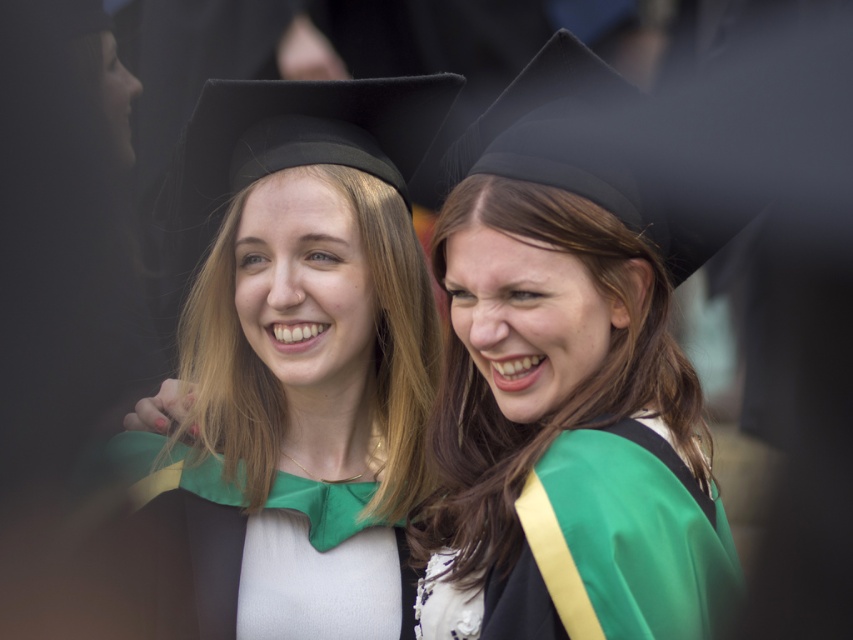
Question: Which point appears closest to the camera in this image?

Choices:
 (A) (581, 433)
 (B) (680, 561)
 (C) (194, 371)

Answer: (B)

Question: Where is matte black graduation cap at center located in relation to green satin gown at center in the image?

Choices:
 (A) below
 (B) above

Answer: (B)

Question: Can you confirm if green satin graduation gown at center is thinner than matte black graduation cap at center?

Choices:
 (A) no
 (B) yes

Answer: (B)

Question: Which point appears closest to the camera in this image?

Choices:
 (A) (642, 564)
 (B) (306, 324)

Answer: (A)

Question: Which point is closer to the camera taking this photo?

Choices:
 (A) (683, 472)
 (B) (584, 438)
 (C) (303, 193)

Answer: (B)

Question: Does green satin graduation gown at center come behind green satin gown at center?

Choices:
 (A) yes
 (B) no

Answer: (A)